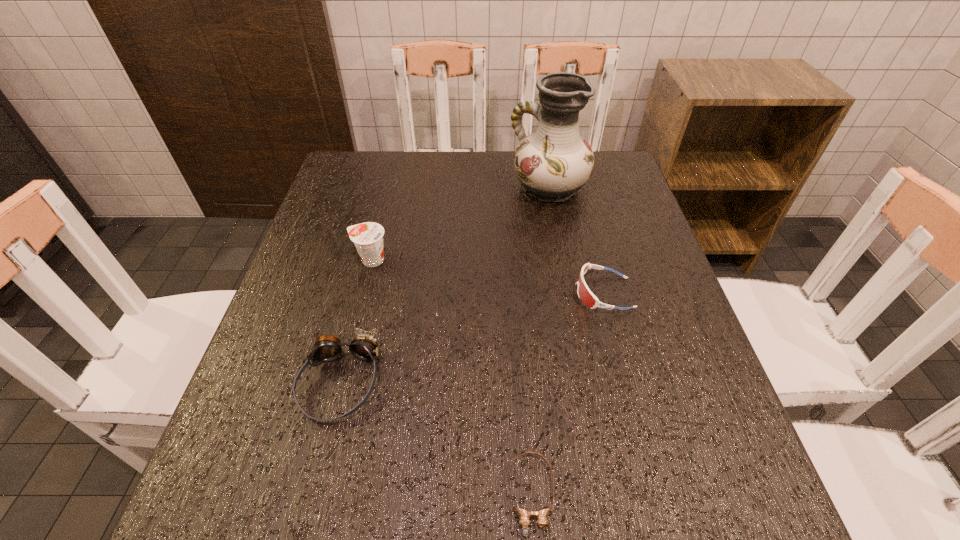
Select which object appears as the second closest to the tallest object. Please provide its 2D coordinates. Your answer should be formatted as a tuple, i.e. [(x, y)], where the tuple contains the x and y coordinates of a point satisfying the conditions above.

[(368, 237)]

Identify the location of the fourth closest object relative to the nearest object. (553, 163).

Identify which goggles is the nearest to the third nearest object. Please provide its 2D coordinates. Your answer should be formatted as a tuple, i.e. [(x, y)], where the tuple contains the x and y coordinates of a point satisfying the conditions above.

[(524, 516)]

In order to click on goggles that is the closest to the shortest goggles in this screenshot , I will do `click(327, 348)`.

Locate an element on the screen. blank space that satisfies the following two spatial constraints: 1. on the front-facing side of the second tallest goggles; 2. on the front lenses and sides of the second goggles from left to right is located at coordinates (657, 494).

Where is `vacant point that satisfies the following two spatial constraints: 1. on the front-facing side of the second shortest object; 2. through the lenses of the leftmost goggles`? The image size is (960, 540). vacant point that satisfies the following two spatial constraints: 1. on the front-facing side of the second shortest object; 2. through the lenses of the leftmost goggles is located at coordinates (627, 382).

Locate an element on the screen. Image resolution: width=960 pixels, height=540 pixels. free space that satisfies the following two spatial constraints: 1. on the front-facing side of the second shortest object; 2. through the lenses of the second nearest object is located at coordinates (627, 382).

What are the coordinates of `free point that satisfies the following two spatial constraints: 1. on the front-facing side of the farthest goggles; 2. on the front lenses and sides of the nearest goggles` in the screenshot? It's located at (657, 494).

Locate an element on the screen. Image resolution: width=960 pixels, height=540 pixels. vacant space that satisfies the following two spatial constraints: 1. on the front-facing side of the third farthest object; 2. through the lenses of the second nearest object is located at coordinates (627, 382).